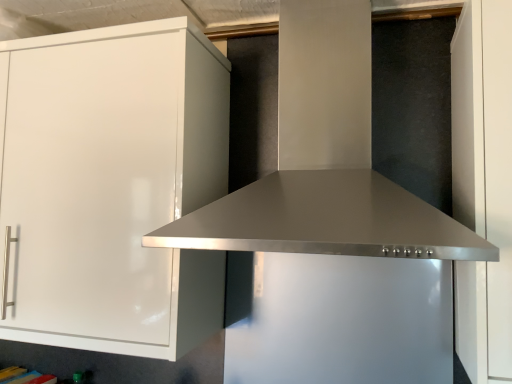
Question: From a real-world perspective, is white glossy cabinet at left beneath stainless steel vent at center?

Choices:
 (A) no
 (B) yes

Answer: (B)

Question: Considering the relative sizes of white glossy cabinet at left and stainless steel vent at center in the image provided, is white glossy cabinet at left shorter than stainless steel vent at center?

Choices:
 (A) yes
 (B) no

Answer: (B)

Question: Is white glossy cabinet at left facing towards stainless steel vent at center?

Choices:
 (A) no
 (B) yes

Answer: (A)

Question: Considering the relative positions of white glossy cabinet at left and stainless steel vent at center in the image provided, is white glossy cabinet at left to the right of stainless steel vent at center from the viewer's perspective?

Choices:
 (A) yes
 (B) no

Answer: (B)

Question: Would you say white glossy cabinet at left is a long distance from stainless steel vent at center?

Choices:
 (A) no
 (B) yes

Answer: (A)

Question: From the image's perspective, is white glossy cabinet at left below stainless steel vent at center?

Choices:
 (A) no
 (B) yes

Answer: (B)

Question: Can you confirm if stainless steel vent at center is positioned to the left of white glossy cabinet at left?

Choices:
 (A) yes
 (B) no

Answer: (B)

Question: From the image's perspective, is stainless steel vent at center above white glossy cabinet at left?

Choices:
 (A) no
 (B) yes

Answer: (B)

Question: Is stainless steel vent at center looking in the opposite direction of white glossy cabinet at left?

Choices:
 (A) yes
 (B) no

Answer: (B)

Question: Are stainless steel vent at center and white glossy cabinet at left located far from each other?

Choices:
 (A) yes
 (B) no

Answer: (B)

Question: Does stainless steel vent at center have a greater width compared to white glossy cabinet at left?

Choices:
 (A) yes
 (B) no

Answer: (A)

Question: Is white glossy cabinet at left located within stainless steel vent at center?

Choices:
 (A) yes
 (B) no

Answer: (B)

Question: From the image's perspective, is stainless steel vent at center above or below white glossy cabinet at left?

Choices:
 (A) below
 (B) above

Answer: (B)